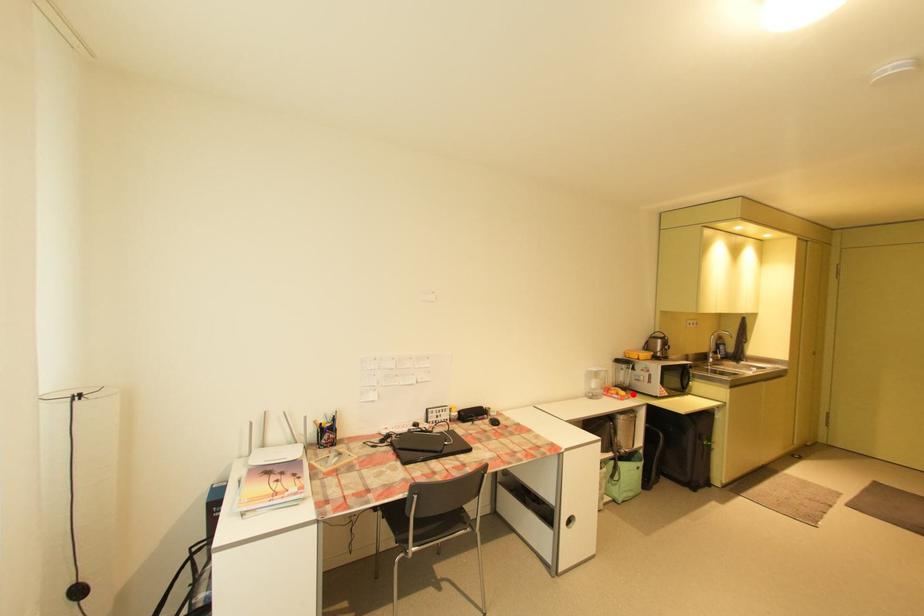
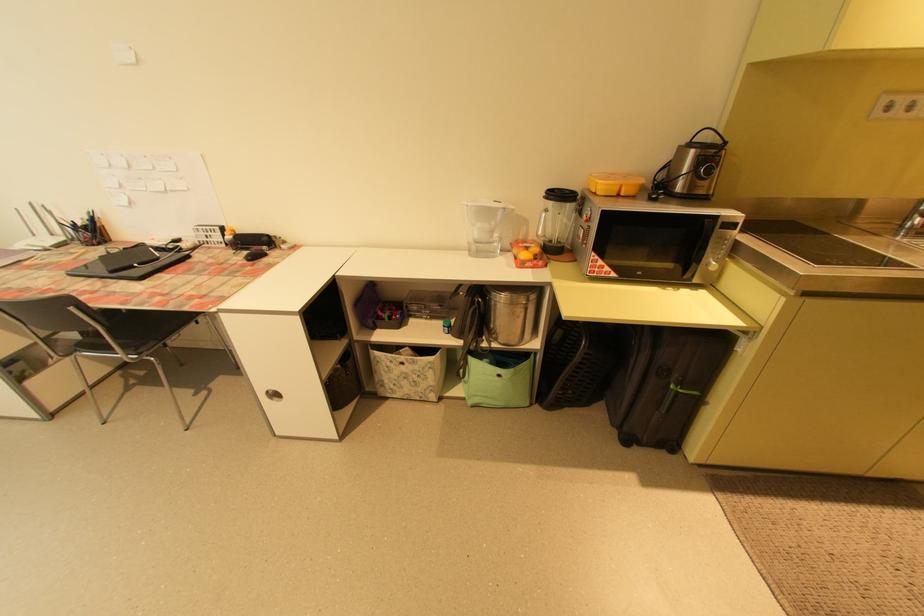
The point at the highlighted location is marked in the first image. Where is the corresponding point in the second image?

(541, 259)